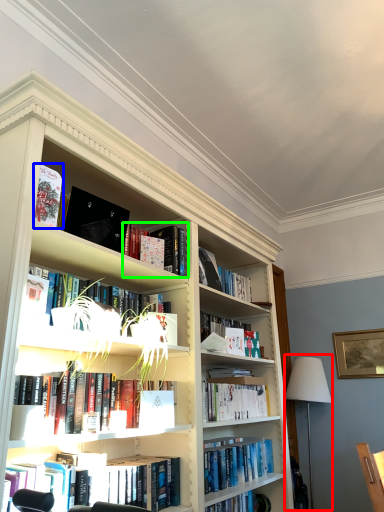
Question: Which is farther away from table lamp (highlighted by a red box)? book (highlighted by a blue box) or book (highlighted by a green box)?

Choices:
 (A) book
 (B) book

Answer: (A)